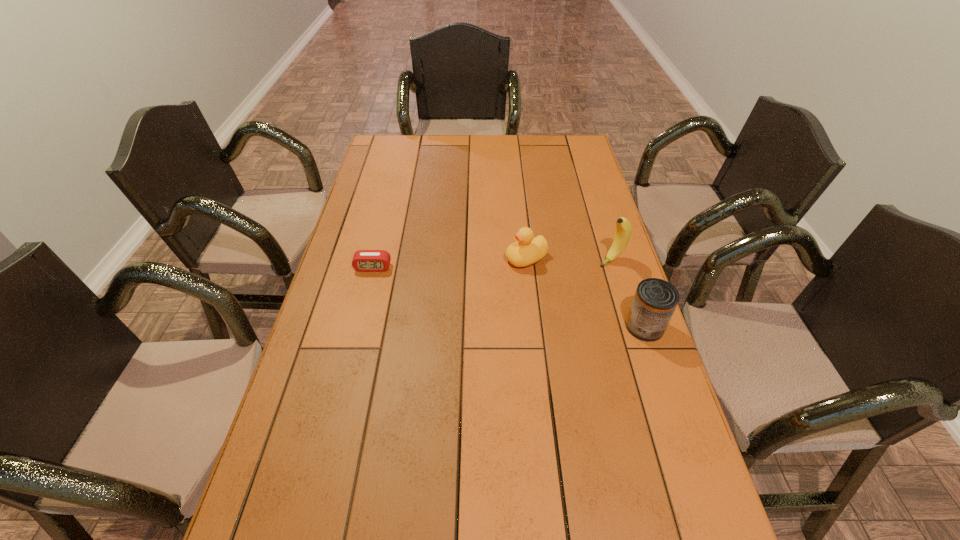
Locate an element on the screen. The height and width of the screenshot is (540, 960). free space at the near left corner of the desktop is located at coordinates (252, 515).

Locate an element on the screen. The image size is (960, 540). vacant space at the far right corner of the desktop is located at coordinates (567, 138).

The image size is (960, 540). What are the coordinates of `free space at the near right corner` in the screenshot? It's located at (708, 523).

Where is `empty space that is in between the alarm clock and the tallest object`? empty space that is in between the alarm clock and the tallest object is located at coordinates (492, 264).

Where is `blank region between the third object from right to left and the shortest object`? This screenshot has width=960, height=540. blank region between the third object from right to left and the shortest object is located at coordinates (449, 263).

Find the location of a particular element. The height and width of the screenshot is (540, 960). vacant region between the can and the third object from right to left is located at coordinates (586, 293).

The width and height of the screenshot is (960, 540). What are the coordinates of `empty space that is in between the banana and the can` in the screenshot? It's located at (628, 293).

What are the coordinates of `vacant area that lies between the can and the alarm clock` in the screenshot? It's located at (509, 297).

The width and height of the screenshot is (960, 540). I want to click on free space between the banana and the leftmost object, so click(x=492, y=264).

At what (x,y) coordinates should I click in order to perform the action: click on empty space that is in between the third object from right to left and the tallest object. Please return your answer as a coordinate pair (x, y). The width and height of the screenshot is (960, 540). Looking at the image, I should click on (569, 259).